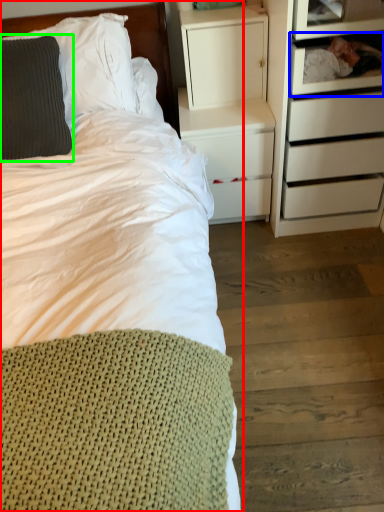
Question: Considering the real-world distances, which object is farthest from bed (highlighted by a red box)? shelf (highlighted by a blue box) or pillow (highlighted by a green box)?

Choices:
 (A) shelf
 (B) pillow

Answer: (A)